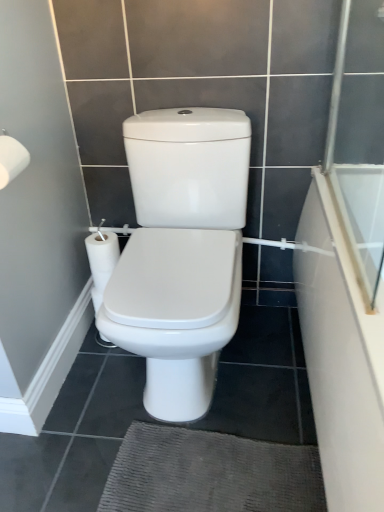
The image size is (384, 512). Find the location of `vacant space underneath transparent glass screen door at right (from a real-world perspective)`. vacant space underneath transparent glass screen door at right (from a real-world perspective) is located at coordinates (339, 225).